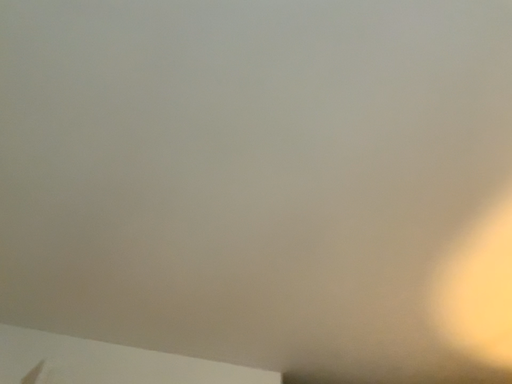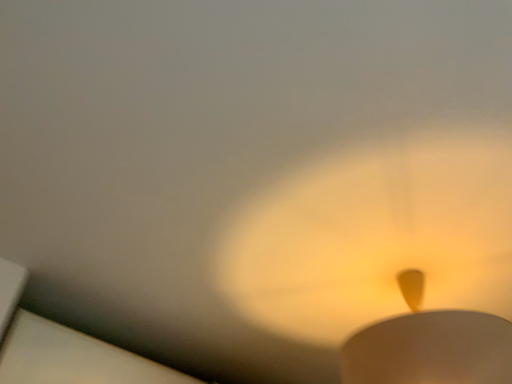
Question: Which way did the camera rotate in the video?

Choices:
 (A) rotated left
 (B) rotated right

Answer: (B)